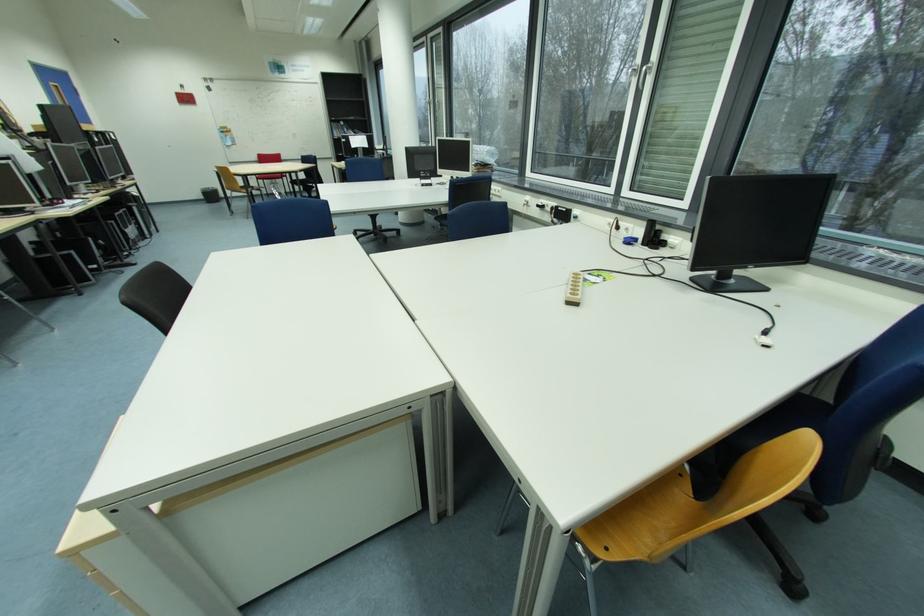
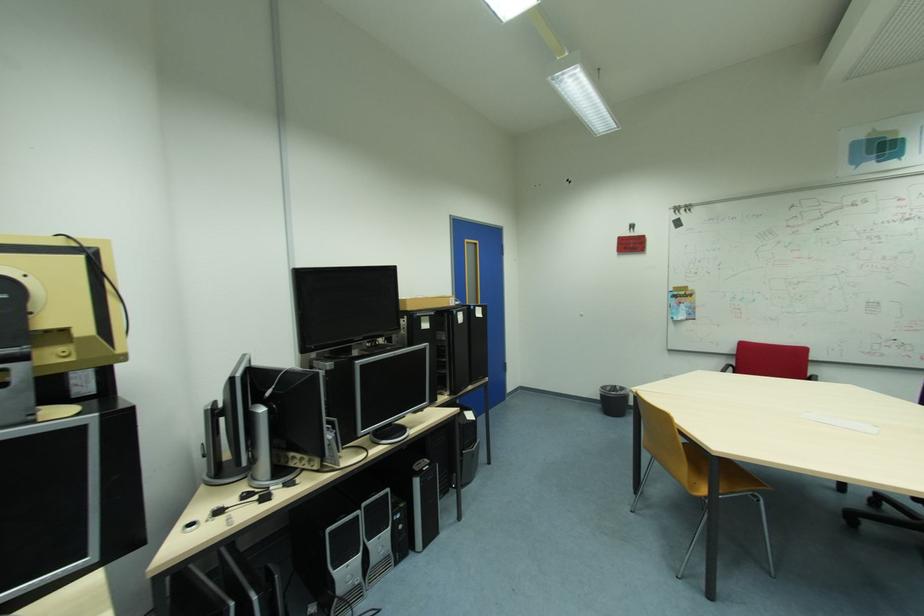
In the second image, find the point that corresponds to (59,84) in the first image.

(473, 241)